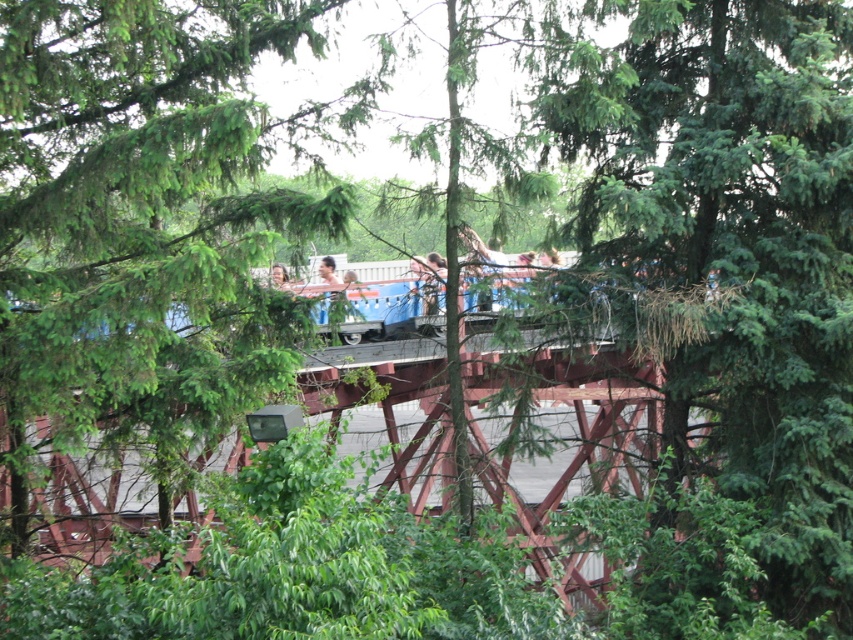
You are a photographer trying to capture the metallic red bridge at center and the green leafy tree at upper center in a single shot. Based on their sizes, which object should you focus on first to ensure both are in frame?

The green leafy tree at upper center is thinner than the metallic red bridge at center, so you should focus on the metallic red bridge at center first to ensure both fit in the frame.

Based on the provided scene, can you determine the exact coordinates of the green leafy tree at center?

The green leafy tree at center is located at coordinates point (728,252).

You are a photographer trying to capture a clear photo of the smooth brown hair at center without the green leafy tree at center blocking it. Can you adjust your position to do so?

The green leafy tree at center is positioned under smooth brown hair at center, so moving your camera position upwards or shifting sideways might allow you to frame the smooth brown hair at center without the tree obstructing the view.